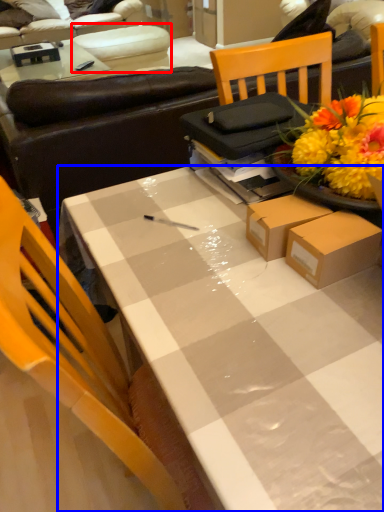
Question: Which point is further to the camera, armchair (highlighted by a red box) or desk (highlighted by a blue box)?

Choices:
 (A) armchair
 (B) desk

Answer: (A)